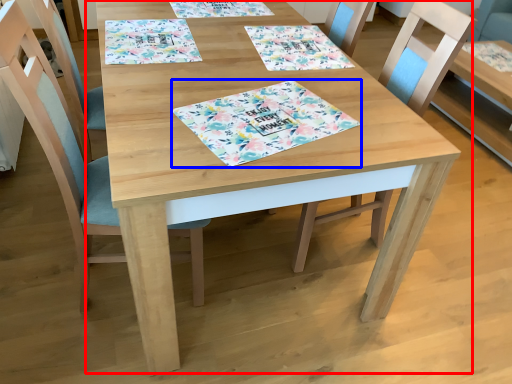
Question: Among these objects, which one is nearest to the camera, table (highlighted by a red box) or place mat (highlighted by a blue box)?

Choices:
 (A) table
 (B) place mat

Answer: (A)